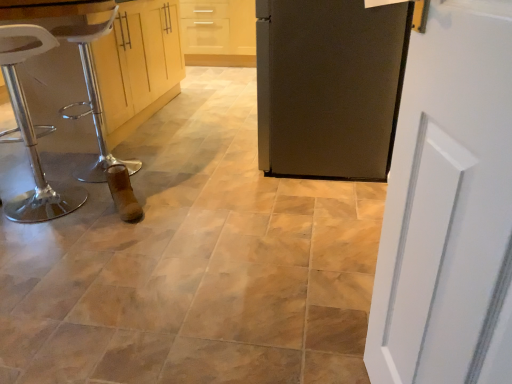
Where is `free area in between matte black refrigerator at center, the 1th door positioned from the back, and white plastic stool at left`? free area in between matte black refrigerator at center, the 1th door positioned from the back, and white plastic stool at left is located at coordinates (213, 177).